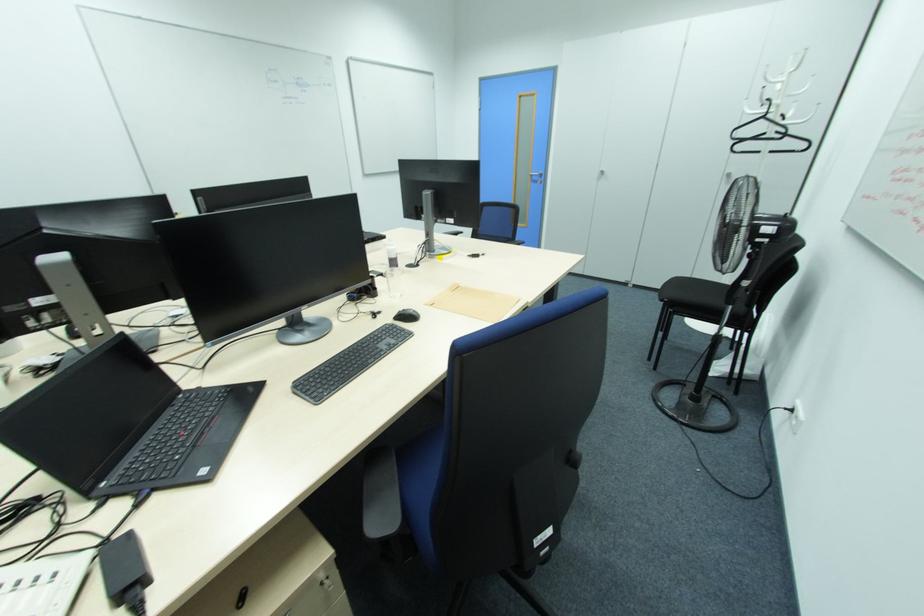
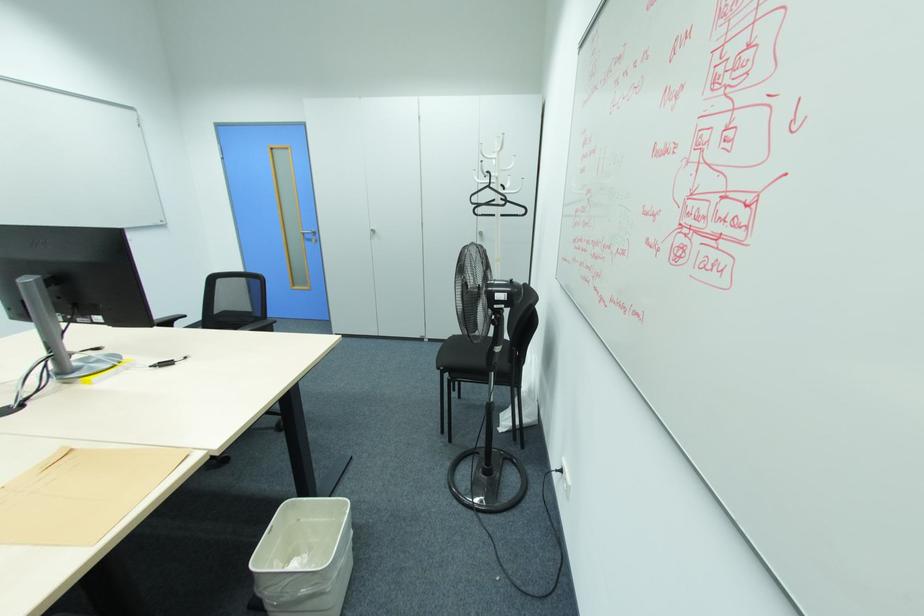
Locate, in the second image, the point that corresponds to [764,118] in the first image.

(490, 187)